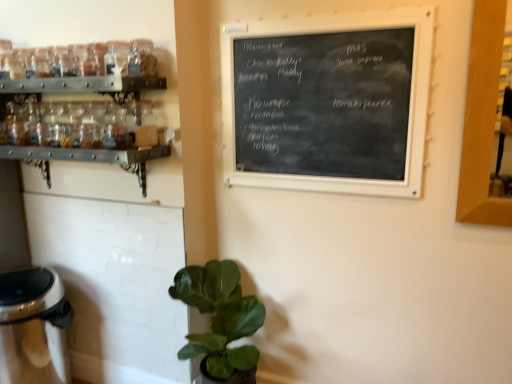
Question: Is satin silver trash can at lower left turned away from green matte plant at lower center?

Choices:
 (A) yes
 (B) no

Answer: (B)

Question: Is satin silver trash can at lower left next to green matte plant at lower center?

Choices:
 (A) no
 (B) yes

Answer: (A)

Question: Is satin silver trash can at lower left shorter than green matte plant at lower center?

Choices:
 (A) yes
 (B) no

Answer: (A)

Question: From a real-world perspective, is satin silver trash can at lower left under green matte plant at lower center?

Choices:
 (A) yes
 (B) no

Answer: (A)

Question: Does satin silver trash can at lower left come behind green matte plant at lower center?

Choices:
 (A) no
 (B) yes

Answer: (B)

Question: From the image's perspective, is green matte plant at lower center positioned above or below satin silver trash can at lower left?

Choices:
 (A) below
 (B) above

Answer: (B)

Question: Is green matte plant at lower center in front of or behind satin silver trash can at lower left in the image?

Choices:
 (A) behind
 (B) front

Answer: (B)

Question: From a real-world perspective, is green matte plant at lower center physically located above or below satin silver trash can at lower left?

Choices:
 (A) above
 (B) below

Answer: (A)

Question: Considering the positions of point (230, 350) and point (32, 283), is point (230, 350) closer or farther from the camera than point (32, 283)?

Choices:
 (A) farther
 (B) closer

Answer: (B)

Question: Does point tap(72, 152) appear closer or farther from the camera than point tap(2, 344)?

Choices:
 (A) farther
 (B) closer

Answer: (B)

Question: From a real-world perspective, relative to satin silver trash can at lower left, is clear glass jars at upper left vertically above or below?

Choices:
 (A) above
 (B) below

Answer: (A)

Question: Looking at their shapes, would you say clear glass jars at upper left is wider or thinner than satin silver trash can at lower left?

Choices:
 (A) thin
 (B) wide

Answer: (A)

Question: Would you say clear glass jars at upper left is to the left or to the right of satin silver trash can at lower left in the picture?

Choices:
 (A) left
 (B) right

Answer: (B)

Question: In terms of size, does satin silver trash can at lower left appear bigger or smaller than black chalkboard at upper center?

Choices:
 (A) big
 (B) small

Answer: (A)

Question: From a real-world perspective, is satin silver trash can at lower left positioned above or below black chalkboard at upper center?

Choices:
 (A) below
 (B) above

Answer: (A)